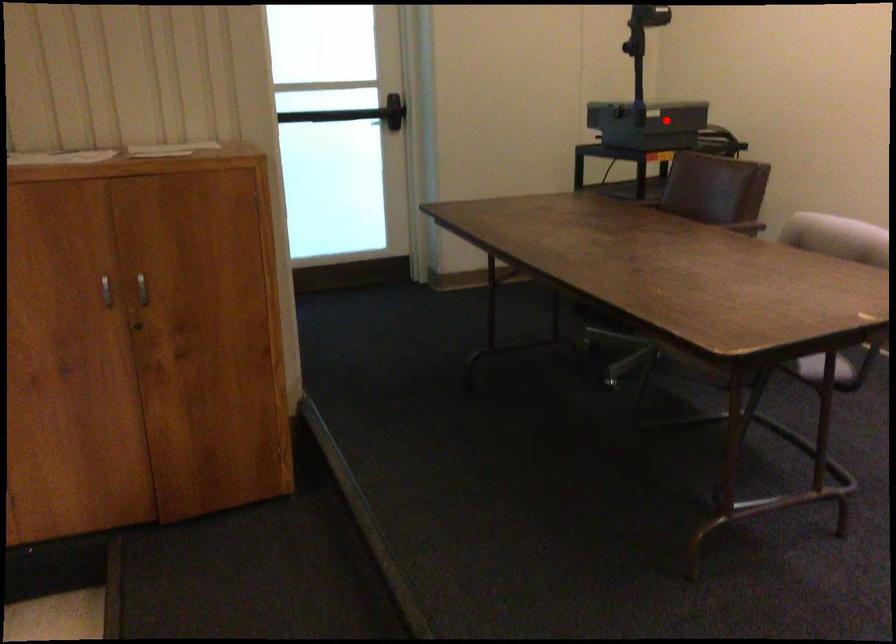
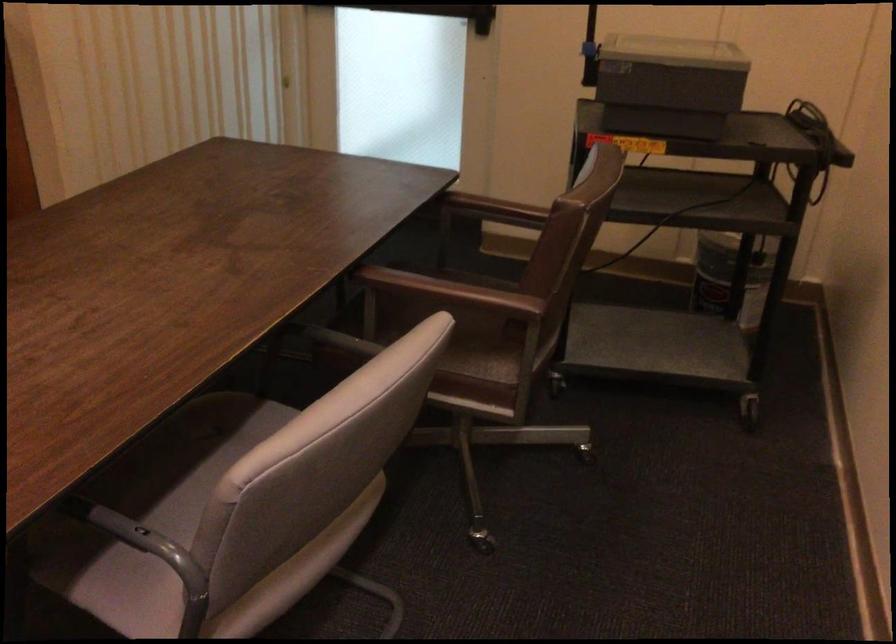
Find the pixel in the second image that matches the highlighted location in the first image.

(668, 84)